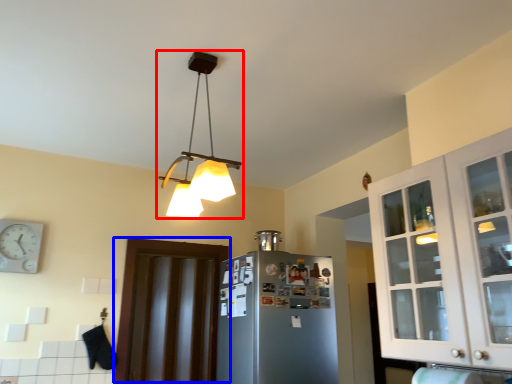
Question: Which point is closer to the camera, lamp (highlighted by a red box) or door (highlighted by a blue box)?

Choices:
 (A) lamp
 (B) door

Answer: (A)